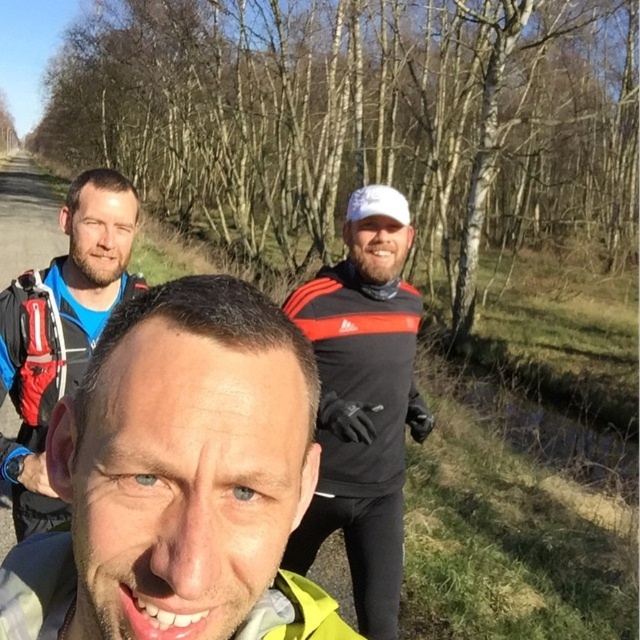
You are trying to decide which jacket to wear for a hike. You see the black matte jacket at center and the matte blue jacket at upper left in the image. Which one would you choose if you want a larger jacket?

The black matte jacket at center is larger in size than the matte blue jacket at upper left, so you should choose the black matte jacket at center for a larger option.

You are a photographer trying to capture a group photo. You notice two jackets in the scene, the matte black jacket at center and the matte blue jacket at upper left. Which jacket appears narrower in the photo?

The matte black jacket at center appears narrower compared to the matte blue jacket at upper left.